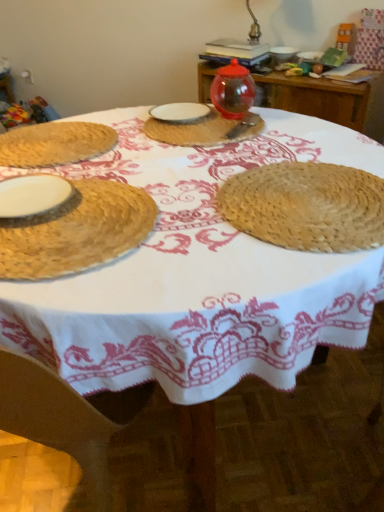
You are a GUI agent. You are given a task and a screenshot of the screen. Output one action in this format:
    pyautogui.click(x=<x>, y=<y>)
    Task: Click on the vacant area that lies between natural straw placemat at center and matte wicker placemat at center
    This screenshot has width=384, height=512.
    Given the screenshot: What is the action you would take?
    pyautogui.click(x=243, y=159)